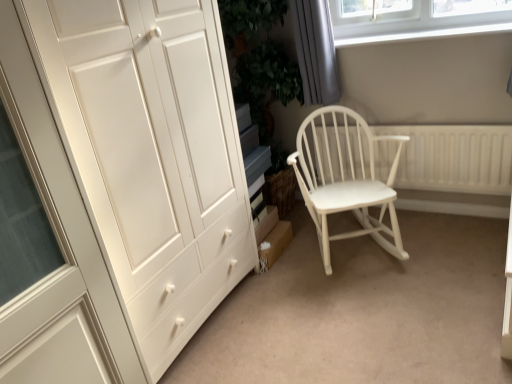
What are the coordinates of `vacant area that lies to the right of white wood rocking chair at center` in the screenshot? It's located at (447, 237).